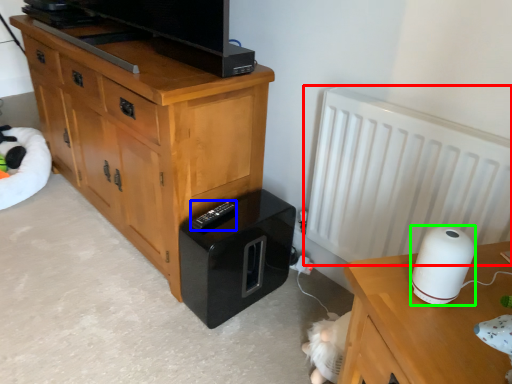
Question: Considering the real-world distances, which object is closest to radiator (highlighted by a red box)? remote (highlighted by a blue box) or appliance (highlighted by a green box).

Choices:
 (A) remote
 (B) appliance

Answer: (B)